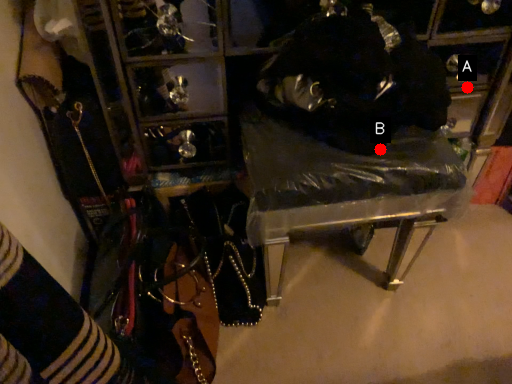
Question: Two points are circled on the image, labeled by A and B beside each circle. Which point is closer to the camera?

Choices:
 (A) A is closer
 (B) B is closer

Answer: (B)